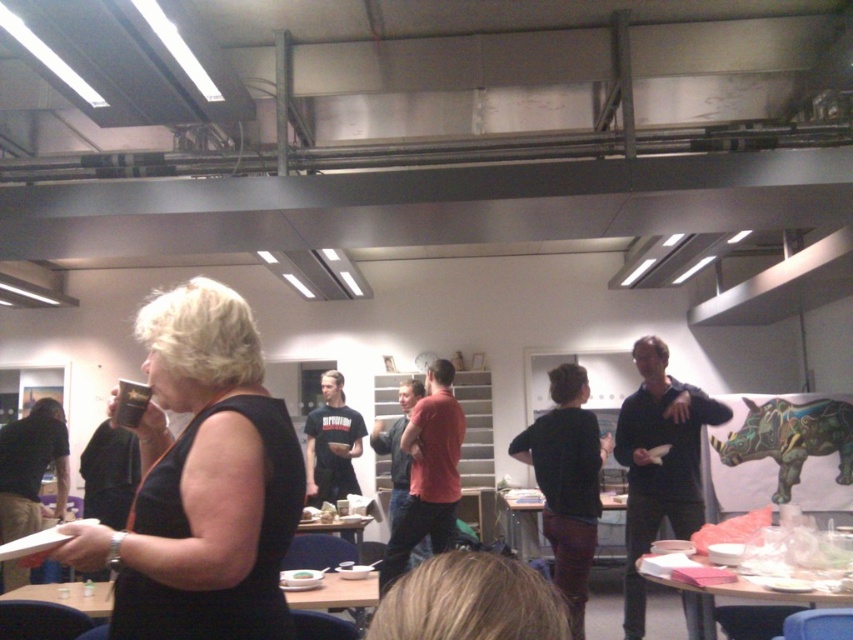
Question: Which point is farther from the camera taking this photo?

Choices:
 (A) (306, 579)
 (B) (155, 528)

Answer: (A)

Question: Is matte black dress at center smaller than white matte plate at center?

Choices:
 (A) no
 (B) yes

Answer: (A)

Question: Is matte black dress at center further to camera compared to white matte plate at center?

Choices:
 (A) no
 (B) yes

Answer: (A)

Question: Which of the following is the closest to the observer?

Choices:
 (A) white matte plate at center
 (B) matte black dress at center

Answer: (B)

Question: Can you confirm if matte black dress at center is smaller than white matte plate at center?

Choices:
 (A) yes
 (B) no

Answer: (B)